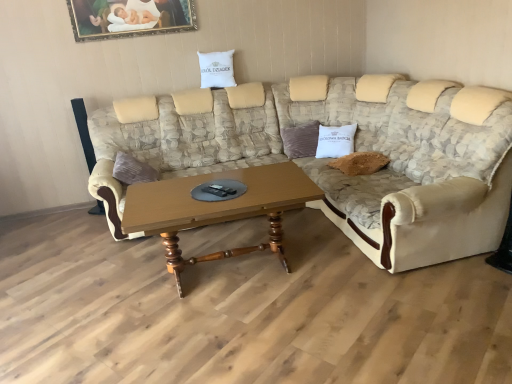
At what (x,y) coordinates should I click in order to perform the action: click on vacant point to the right of wooden polished coffee table at center. Please return your answer as a coordinate pair (x, y). This screenshot has width=512, height=384. Looking at the image, I should click on (361, 281).